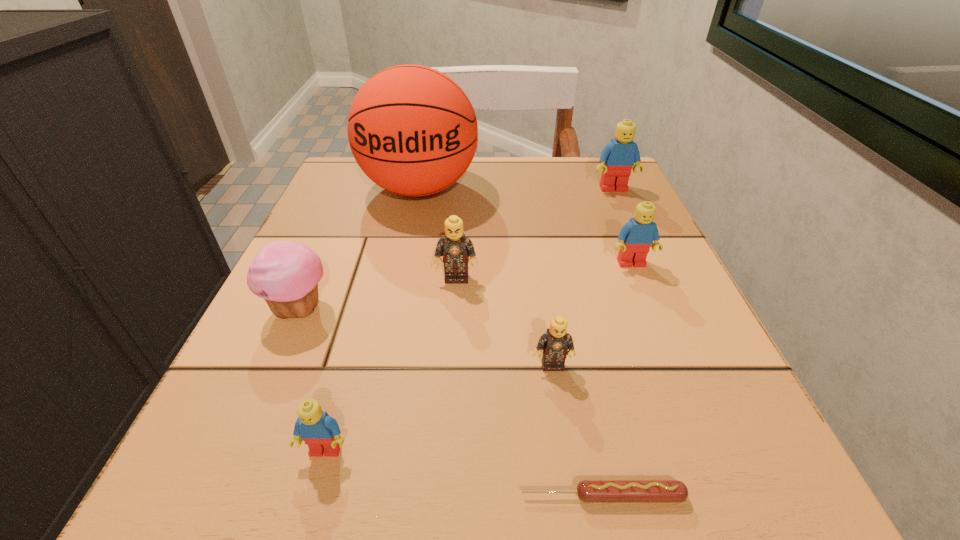
Where is `free space located in front of the right tan Lego`? free space located in front of the right tan Lego is located at coordinates (559, 411).

The image size is (960, 540). In order to click on vacant space situated on the face of the smallest blue Lego in this screenshot , I will do `click(306, 518)`.

Find the location of a particular element. Image resolution: width=960 pixels, height=540 pixels. vacant space located on the left of the shortest object is located at coordinates (221, 496).

Locate an element on the screen. This screenshot has height=540, width=960. basketball situated at the far edge is located at coordinates (413, 131).

Identify the location of Lego that is positioned at the far edge. (618, 157).

The image size is (960, 540). Identify the location of Lego that is positioned at the near edge. (318, 430).

This screenshot has width=960, height=540. Identify the location of sausage that is at the near edge. (589, 491).

Where is `basketball that is at the left edge`? basketball that is at the left edge is located at coordinates (413, 131).

The image size is (960, 540). In order to click on cupcake that is at the left edge in this screenshot , I will do [285, 274].

Locate an element on the screen. Lego positioned at the left edge is located at coordinates (318, 430).